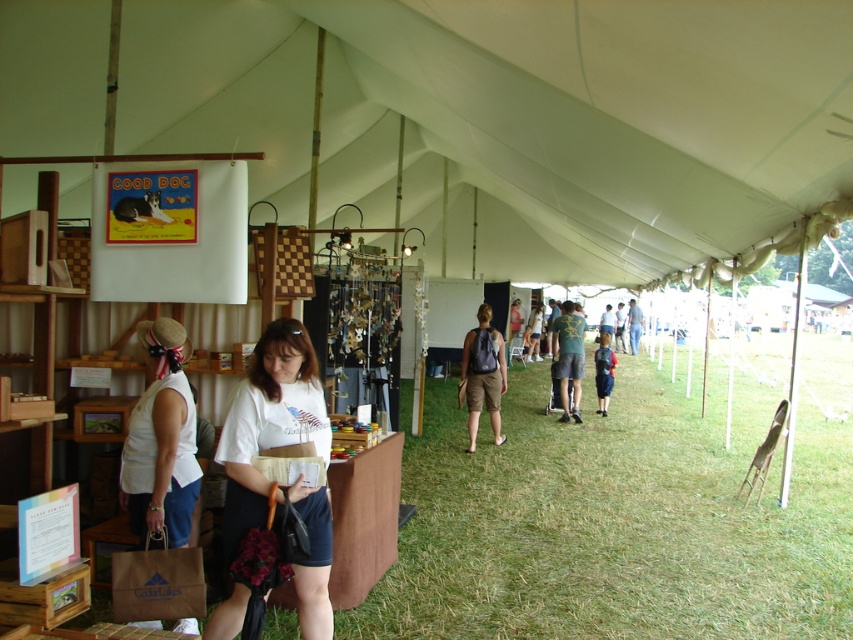
Question: Does white fabric canopy at upper left have a smaller size compared to green textured shorts at center?

Choices:
 (A) yes
 (B) no

Answer: (B)

Question: Can you confirm if white cotton shirt at center is smaller than matte brown shorts at center?

Choices:
 (A) yes
 (B) no

Answer: (A)

Question: Estimate the real-world distances between objects in this image. Which object is farther from the white fabric canopy at upper left?

Choices:
 (A) green textured shorts at center
 (B) matte brown shorts at center
 (C) blue denim shorts at center

Answer: (C)

Question: Which point appears farthest from the camera in this image?

Choices:
 (A) (306, 433)
 (B) (601, 380)
 (C) (384, 605)

Answer: (B)

Question: Is the position of green grass at center more distant than that of matte brown shorts at center?

Choices:
 (A) yes
 (B) no

Answer: (B)

Question: Among these objects, which one is nearest to the camera?

Choices:
 (A) blue denim shorts at center
 (B) green grass at center

Answer: (B)